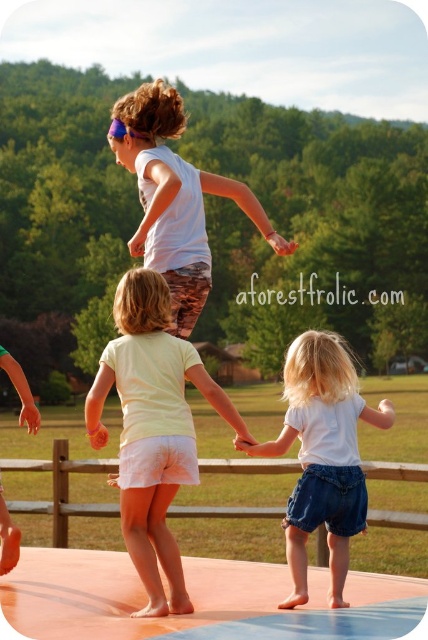
Question: Which point is farther to the camera?

Choices:
 (A) yellow cotton shirt at center
 (B) white cotton shirt at center
 (C) white matte shirt at upper center

Answer: (C)

Question: Which of the following is the closest to the observer?

Choices:
 (A) (335, 342)
 (B) (177, 179)

Answer: (A)

Question: Can you confirm if yellow cotton shirt at center is smaller than white cotton shirt at center?

Choices:
 (A) yes
 (B) no

Answer: (B)

Question: Among these objects, which one is nearest to the camera?

Choices:
 (A) yellow cotton shirt at center
 (B) white cotton shirt at center

Answer: (A)

Question: Can you confirm if yellow cotton shirt at center is bigger than white matte shirt at upper center?

Choices:
 (A) no
 (B) yes

Answer: (A)

Question: Does yellow cotton shirt at center have a smaller size compared to white matte shirt at upper center?

Choices:
 (A) no
 (B) yes

Answer: (B)